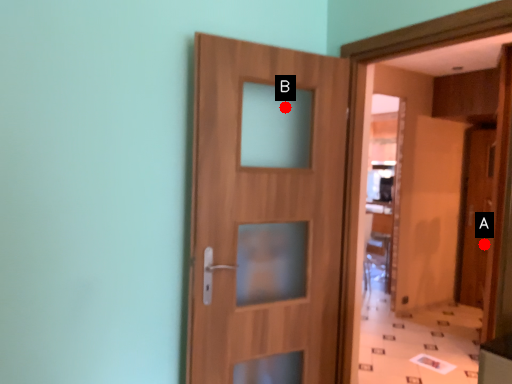
Question: Two points are circled on the image, labeled by A and B beside each circle. Which point is closer to the camera?

Choices:
 (A) A is closer
 (B) B is closer

Answer: (B)